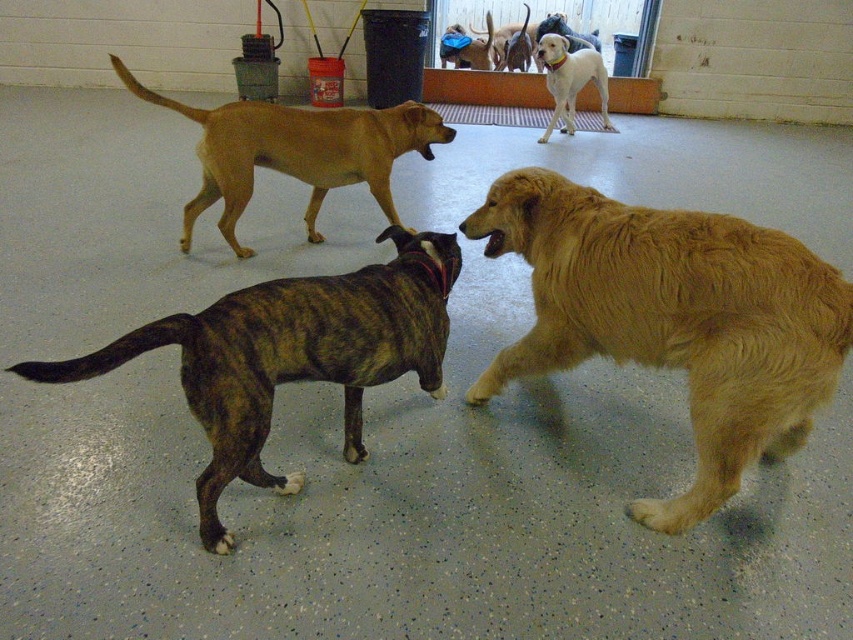
Who is lower down, golden brown fur at center or blue fabric dog at center?

golden brown fur at center is below.

Does golden brown fur at center have a lesser width compared to blue fabric dog at center?

No, golden brown fur at center is not thinner than blue fabric dog at center.

Locate an element on the screen. The image size is (853, 640). golden brown fur at center is located at coordinates point(294,150).

Where is `golden brown fur at center`? golden brown fur at center is located at coordinates (294, 150).

Is brindle fur dog at lower left smaller than white smooth dog at upper center?

Correct, brindle fur dog at lower left occupies less space than white smooth dog at upper center.

Which is in front, point (245, 396) or point (602, 115)?

Point (245, 396) is in front.

The width and height of the screenshot is (853, 640). Describe the element at coordinates (291, 355) in the screenshot. I see `brindle fur dog at lower left` at that location.

Find the location of a particular element. This screenshot has width=853, height=640. brindle fur dog at lower left is located at coordinates (291, 355).

Between golden fur dog at center and golden brown fur at center, which one is positioned lower?

golden fur dog at center is lower down.

Is golden fur dog at center positioned in front of golden brown fur at center?

That is True.

Is point (743, 224) closer to camera compared to point (387, 168)?

Yes, it is.

Where is `golden fur dog at center`? This screenshot has width=853, height=640. golden fur dog at center is located at coordinates (672, 317).